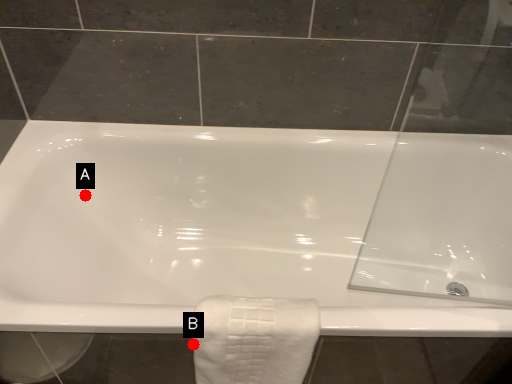
Question: Two points are circled on the image, labeled by A and B beside each circle. Which of the following is the closest to the observer?

Choices:
 (A) A is closer
 (B) B is closer

Answer: (B)